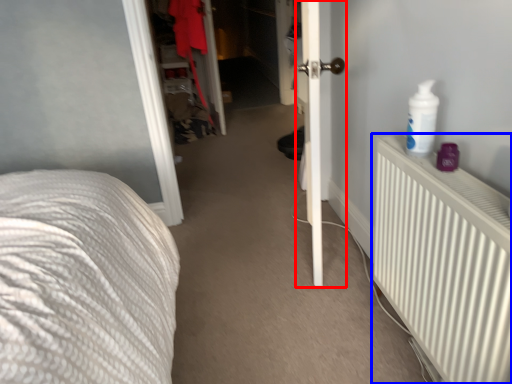
Question: Which of the following is the closest to the observer, door (highlighted by a red box) or radiator (highlighted by a blue box)?

Choices:
 (A) door
 (B) radiator

Answer: (B)